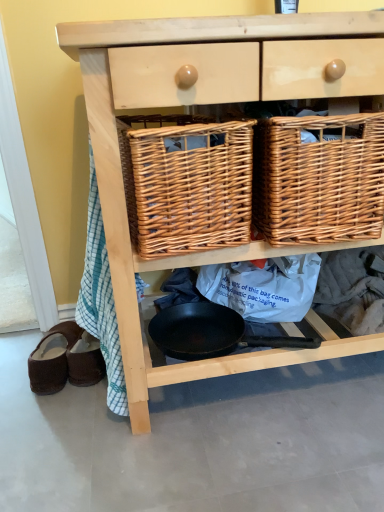
Locate an element on the screen. free location in front of brown suede sandals at lower left, which appears as the 2th footwear when viewed from the left is located at coordinates (67, 410).